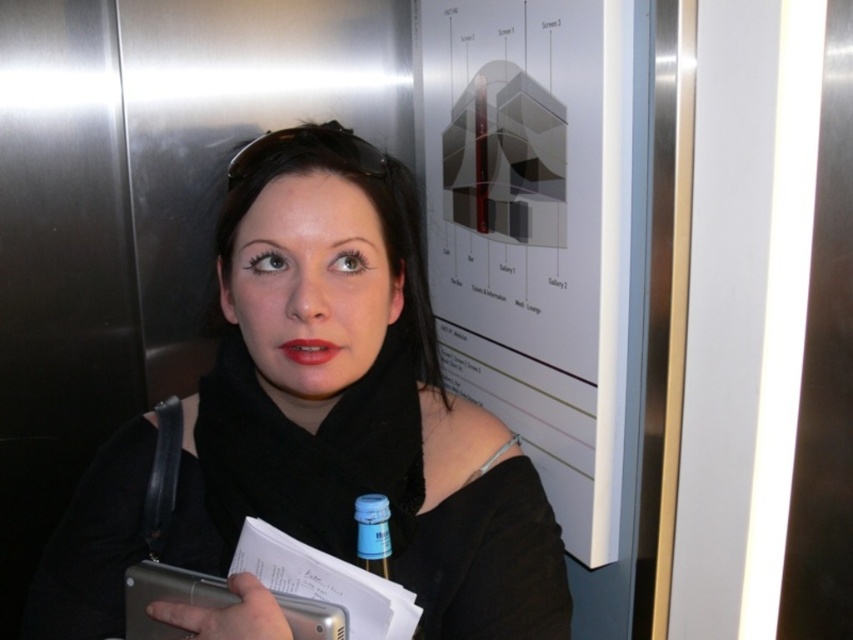
In the scene shown: Does black matte scarf at center have a smaller size compared to blue plastic bottle at center?

No, black matte scarf at center is not smaller than blue plastic bottle at center.

Between black matte scarf at center and blue plastic bottle at center, which one appears on the right side from the viewer's perspective?

Positioned to the right is blue plastic bottle at center.

Is point (376, 250) behind point (361, 557)?

Yes.

Where is `black matte scarf at center`? This screenshot has width=853, height=640. black matte scarf at center is located at coordinates (355, 403).

Does blue plastic bottle at center appear over matte red lipstick at center?

Actually, blue plastic bottle at center is below matte red lipstick at center.

How far apart are blue plastic bottle at center and matte red lipstick at center?

blue plastic bottle at center is 5.54 inches from matte red lipstick at center.

Who is more distant from viewer, (374, 500) or (303, 348)?

The point (374, 500) is behind.

This screenshot has width=853, height=640. I want to click on blue plastic bottle at center, so click(372, 532).

Is black matte scarf at center closer to camera compared to matte red lipstick at center?

Yes, it is.

Who is positioned more to the left, black matte scarf at center or matte red lipstick at center?

matte red lipstick at center is more to the left.

Who is more distant from viewer, (x=227, y=624) or (x=331, y=342)?

Point (x=331, y=342)

At what (x,y) coordinates should I click in order to perform the action: click on black matte scarf at center. Please return your answer as a coordinate pair (x, y). Looking at the image, I should click on tap(355, 403).